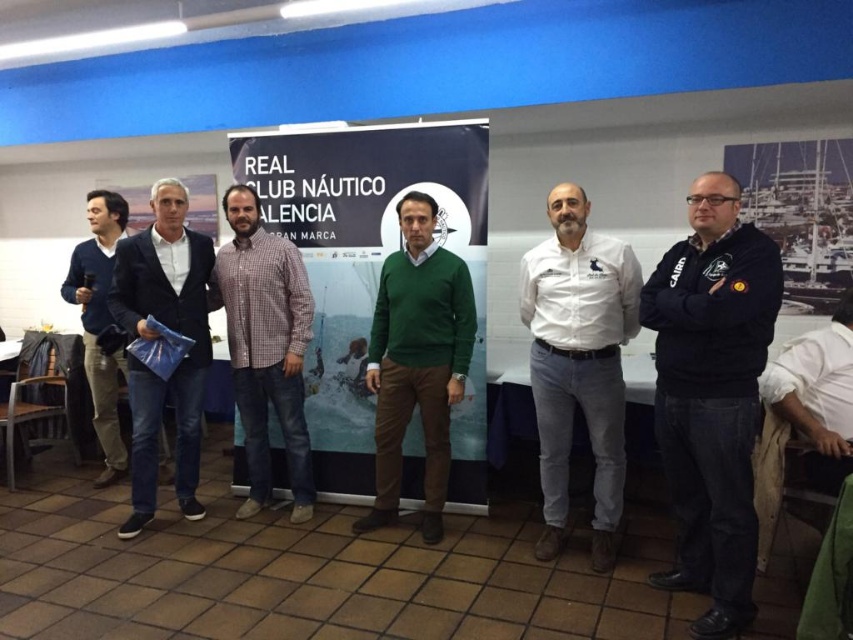
Question: Is white cotton shirt at center thinner than dark blue suit at center?

Choices:
 (A) yes
 (B) no

Answer: (B)

Question: Among these objects, which one is farthest from the camera?

Choices:
 (A) matte blue sweater at left
 (B) checkered fabric shirt at center
 (C) white cotton shirt at center

Answer: (A)

Question: Can you confirm if blue fabric poster at center is positioned below checkered fabric shirt at center?

Choices:
 (A) yes
 (B) no

Answer: (B)

Question: Which point appears farthest from the camera in this image?

Choices:
 (A) (605, 320)
 (B) (183, 408)

Answer: (B)

Question: Which object is the farthest from the dark blue suit at center?

Choices:
 (A) white cotton shirt at center
 (B) checkered fabric shirt at center

Answer: (A)

Question: Is black fleece jacket at center below matte blue sweater at left?

Choices:
 (A) yes
 (B) no

Answer: (A)